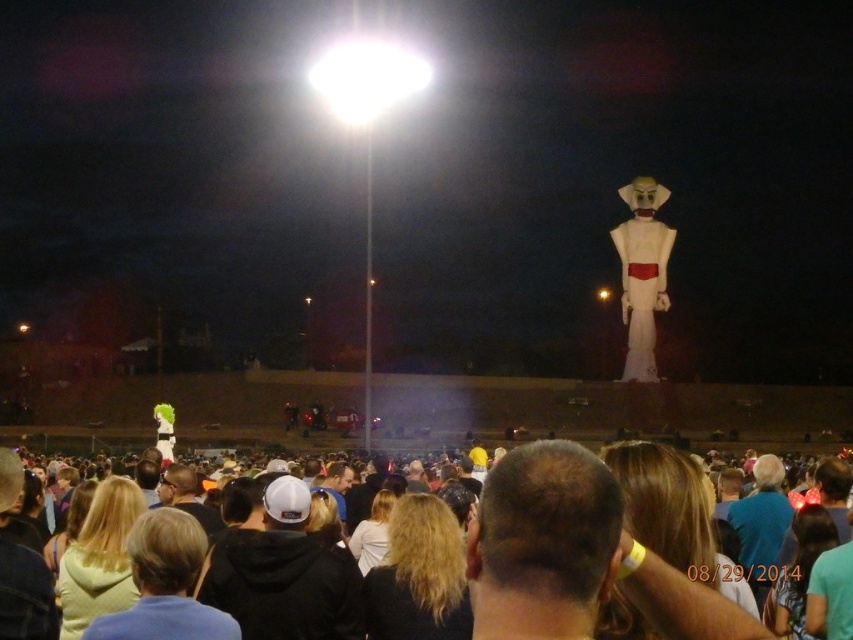
Question: Which object appears farthest from the camera in this image?

Choices:
 (A) white matte figure at upper right
 (B) dark brown hair at center

Answer: (A)

Question: Is dark brown hair at center above white matte figure at upper right?

Choices:
 (A) yes
 (B) no

Answer: (B)

Question: Among these objects, which one is nearest to the camera?

Choices:
 (A) dark brown hair at center
 (B) white matte figure at upper right

Answer: (A)

Question: Does dark brown hair at center lie in front of white matte figure at upper right?

Choices:
 (A) yes
 (B) no

Answer: (A)

Question: Does dark brown hair at center have a greater width compared to white matte figure at upper right?

Choices:
 (A) yes
 (B) no

Answer: (A)